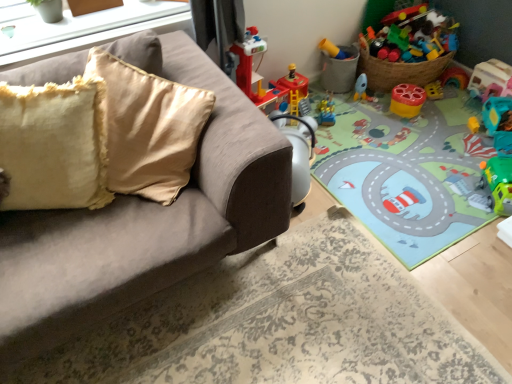
The height and width of the screenshot is (384, 512). I want to click on free region on the left part of rubber duck at lower right, marked as the fifth toy in a left-to-right arrangement, so click(x=449, y=132).